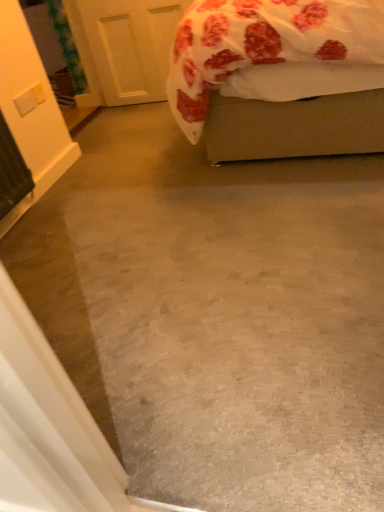
Question: In the image, is white matte door at upper left positioned in front of or behind fluffy white bed at upper right?

Choices:
 (A) front
 (B) behind

Answer: (B)

Question: From a real-world perspective, is white matte door at upper left physically located above or below fluffy white bed at upper right?

Choices:
 (A) above
 (B) below

Answer: (B)

Question: Considering the positions of white matte door at upper left and fluffy white bed at upper right in the image, is white matte door at upper left taller or shorter than fluffy white bed at upper right?

Choices:
 (A) tall
 (B) short

Answer: (B)

Question: Would you say fluffy white bed at upper right is to the left or to the right of white matte door at upper left in the picture?

Choices:
 (A) right
 (B) left

Answer: (A)

Question: From a real-world perspective, is fluffy white bed at upper right positioned above or below white matte door at upper left?

Choices:
 (A) below
 (B) above

Answer: (B)

Question: Does point (297, 29) appear closer or farther from the camera than point (105, 62)?

Choices:
 (A) closer
 (B) farther

Answer: (A)

Question: From the image's perspective, is fluffy white bed at upper right positioned above or below white matte door at upper left?

Choices:
 (A) below
 (B) above

Answer: (A)